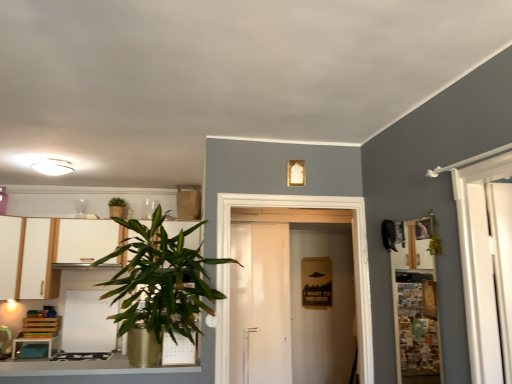
Question: From the image's perspective, is white matte cabinet at left, the second cabinetry in the left-to-right sequence, under white glossy stove at lower left?

Choices:
 (A) yes
 (B) no

Answer: (B)

Question: Can we say white matte cabinet at left, which appears as the first cabinetry when viewed from the right, lies outside white glossy stove at lower left?

Choices:
 (A) no
 (B) yes

Answer: (B)

Question: Can you confirm if white matte cabinet at left, which appears as the first cabinetry when viewed from the right, is bigger than white glossy stove at lower left?

Choices:
 (A) no
 (B) yes

Answer: (B)

Question: Does white matte cabinet at left, the second cabinetry in the left-to-right sequence, have a smaller size compared to white glossy stove at lower left?

Choices:
 (A) no
 (B) yes

Answer: (A)

Question: Is the depth of white matte cabinet at left, the second cabinetry in the left-to-right sequence, greater than that of white glossy stove at lower left?

Choices:
 (A) yes
 (B) no

Answer: (B)

Question: Visually, is white glossy cabinet at left positioned to the left or to the right of green leafy plant at upper left, the first houseplant from the back?

Choices:
 (A) right
 (B) left

Answer: (B)

Question: From the image's perspective, is white glossy cabinet at left above or below green leafy plant at upper left, the 1th houseplant in the left-to-right sequence?

Choices:
 (A) above
 (B) below

Answer: (B)

Question: In the image, is white glossy cabinet at left positioned in front of or behind green leafy plant at upper left, the first houseplant from the back?

Choices:
 (A) behind
 (B) front

Answer: (B)

Question: Is white glossy cabinet at left situated inside green leafy plant at upper left, arranged as the 2th houseplant when viewed from the front, or outside?

Choices:
 (A) inside
 (B) outside

Answer: (B)

Question: Is white glossy stove at lower left wider or thinner than white glossy cabinet at left?

Choices:
 (A) wide
 (B) thin

Answer: (B)

Question: Is white glossy stove at lower left taller or shorter than white glossy cabinet at left?

Choices:
 (A) short
 (B) tall

Answer: (A)

Question: Would you say white glossy stove at lower left is to the left or to the right of white glossy cabinet at left in the picture?

Choices:
 (A) left
 (B) right

Answer: (A)

Question: Is white glossy stove at lower left bigger or smaller than white glossy cabinet at left?

Choices:
 (A) big
 (B) small

Answer: (B)

Question: In terms of height, does wooden/matte shelf at right look taller or shorter compared to white matte cabinet at left, which appears as the first cabinetry when viewed from the right?

Choices:
 (A) tall
 (B) short

Answer: (A)

Question: In the image, is wooden/matte shelf at right positioned in front of or behind white matte cabinet at left, which appears as the first cabinetry when viewed from the right?

Choices:
 (A) front
 (B) behind

Answer: (A)